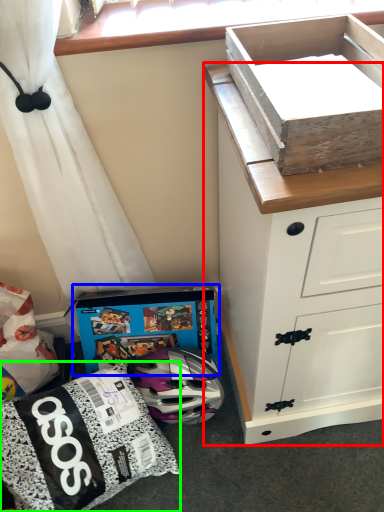
Question: Which object is the farthest from chest of drawers (highlighted by a red box)? Choose among these: cardboard box (highlighted by a blue box) or kit (highlighted by a green box).

Choices:
 (A) cardboard box
 (B) kit

Answer: (B)